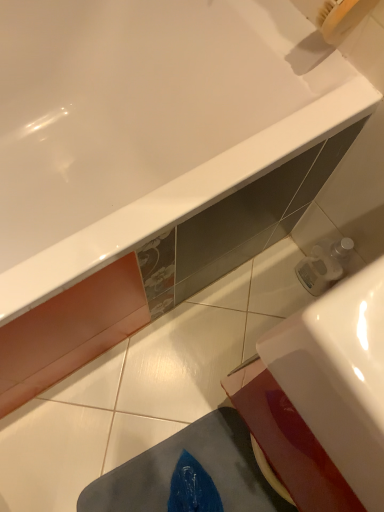
Question: Is point (92, 208) closer or farther from the camera than point (294, 316)?

Choices:
 (A) closer
 (B) farther

Answer: (B)

Question: From a real-world perspective, is white glossy bathtub at upper center above or below white glossy sink at lower right?

Choices:
 (A) above
 (B) below

Answer: (B)

Question: Looking at their shapes, would you say white glossy bathtub at upper center is wider or thinner than white glossy sink at lower right?

Choices:
 (A) wide
 (B) thin

Answer: (A)

Question: From a real-world perspective, relative to white glossy bathtub at upper center, is white glossy sink at lower right vertically above or below?

Choices:
 (A) above
 (B) below

Answer: (A)

Question: In terms of width, does white glossy sink at lower right look wider or thinner when compared to white glossy bathtub at upper center?

Choices:
 (A) thin
 (B) wide

Answer: (A)

Question: Is white glossy sink at lower right to the left or to the right of white glossy bathtub at upper center in the image?

Choices:
 (A) right
 (B) left

Answer: (A)

Question: From the image's perspective, is white glossy sink at lower right located above or below white glossy bathtub at upper center?

Choices:
 (A) below
 (B) above

Answer: (A)